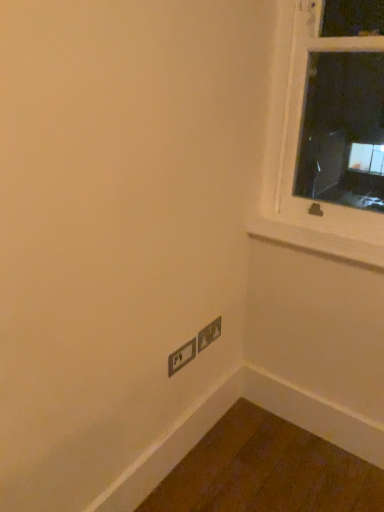
Question: Considering the relative positions of wooden at upper right and matte gray power plugs and sockets at lower right, which ranks as the second power plugs and sockets in left-to-right order, in the image provided, is wooden at upper right to the left of matte gray power plugs and sockets at lower right, which ranks as the second power plugs and sockets in left-to-right order, from the viewer's perspective?

Choices:
 (A) no
 (B) yes

Answer: (A)

Question: Does wooden at upper right have a greater height compared to matte gray power plugs and sockets at lower right, which is the first power plugs and sockets in right-to-left order?

Choices:
 (A) no
 (B) yes

Answer: (A)

Question: Is wooden at upper right smaller than matte gray power plugs and sockets at lower right, which is the first power plugs and sockets in right-to-left order?

Choices:
 (A) no
 (B) yes

Answer: (A)

Question: From a real-world perspective, is wooden at upper right located higher than matte gray power plugs and sockets at lower right, which ranks as the second power plugs and sockets in left-to-right order?

Choices:
 (A) no
 (B) yes

Answer: (B)

Question: Can you confirm if wooden at upper right is shorter than matte gray power plugs and sockets at lower right, which ranks as the second power plugs and sockets in left-to-right order?

Choices:
 (A) yes
 (B) no

Answer: (A)

Question: From a real-world perspective, is matte gray power plugs and sockets at lower right, which ranks as the second power plugs and sockets in left-to-right order, physically located above or below wooden at upper right?

Choices:
 (A) above
 (B) below

Answer: (B)

Question: From the image's perspective, is matte gray power plugs and sockets at lower right, which is the first power plugs and sockets in right-to-left order, above or below wooden at upper right?

Choices:
 (A) above
 (B) below

Answer: (B)

Question: Is matte gray power plugs and sockets at lower right, which ranks as the second power plugs and sockets in left-to-right order, inside the boundaries of wooden at upper right, or outside?

Choices:
 (A) outside
 (B) inside

Answer: (A)

Question: In terms of width, does matte gray power plugs and sockets at lower right, which is the first power plugs and sockets in right-to-left order, look wider or thinner when compared to wooden at upper right?

Choices:
 (A) thin
 (B) wide

Answer: (A)

Question: Is matte black power plugs and sockets at lower center, which is counted as the second power plugs and sockets, starting from the right, taller or shorter than wooden at upper right?

Choices:
 (A) short
 (B) tall

Answer: (B)

Question: From the image's perspective, is matte black power plugs and sockets at lower center, which is counted as the second power plugs and sockets, starting from the right, located above or below wooden at upper right?

Choices:
 (A) above
 (B) below

Answer: (B)

Question: Looking at their shapes, would you say matte black power plugs and sockets at lower center, which is counted as the second power plugs and sockets, starting from the right, is wider or thinner than wooden at upper right?

Choices:
 (A) thin
 (B) wide

Answer: (A)

Question: Based on their sizes in the image, would you say matte black power plugs and sockets at lower center, which is counted as the second power plugs and sockets, starting from the right, is bigger or smaller than wooden at upper right?

Choices:
 (A) small
 (B) big

Answer: (A)

Question: From a real-world perspective, relative to matte black power plugs and sockets at lower center, the 1th power plugs and sockets viewed from the left, is matte gray power plugs and sockets at lower right, which is the first power plugs and sockets in right-to-left order, vertically above or below?

Choices:
 (A) above
 (B) below

Answer: (A)

Question: Looking at their shapes, would you say matte gray power plugs and sockets at lower right, which is the first power plugs and sockets in right-to-left order, is wider or thinner than matte black power plugs and sockets at lower center, which is counted as the second power plugs and sockets, starting from the right?

Choices:
 (A) thin
 (B) wide

Answer: (A)